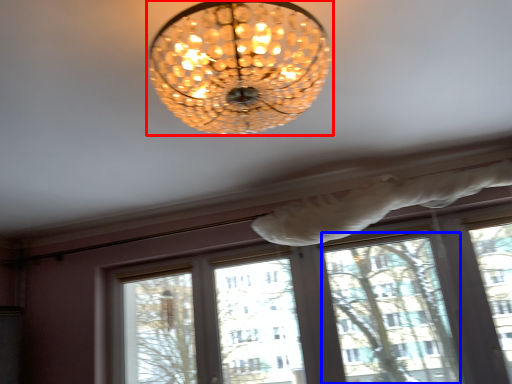
Question: Which object is further to the camera taking this photo, lamp (highlighted by a red box) or window frame (highlighted by a blue box)?

Choices:
 (A) lamp
 (B) window frame

Answer: (B)